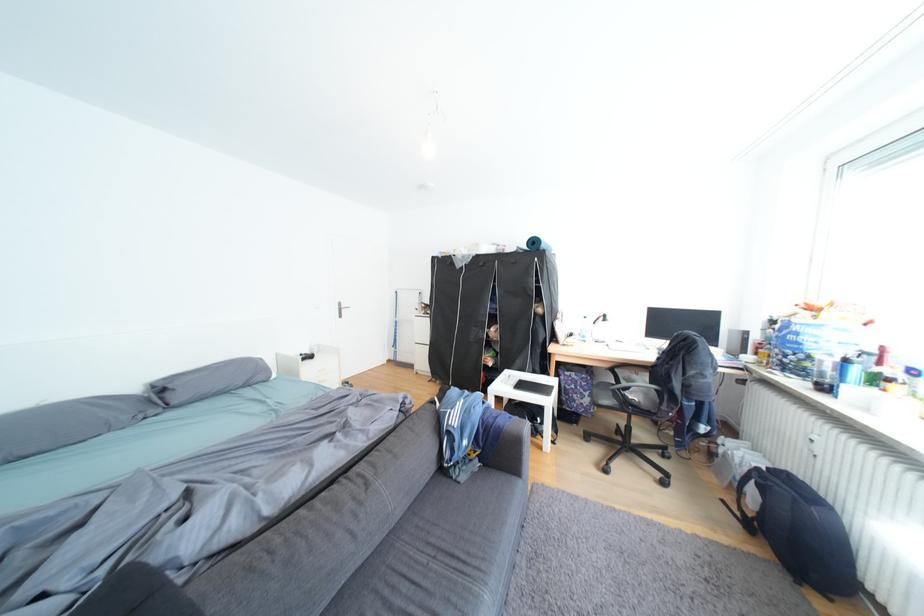
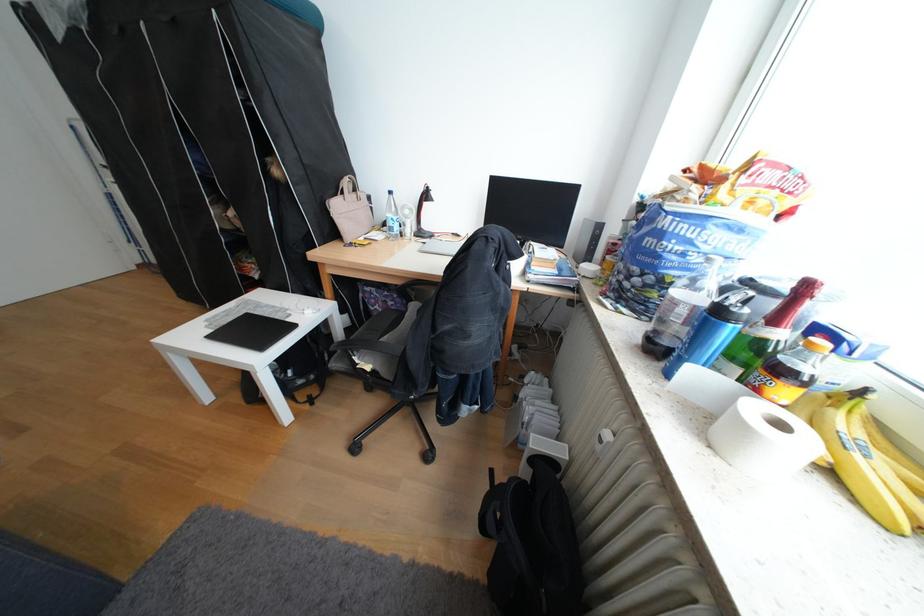
Locate, in the second image, the point that corresponds to (x=896, y=350) in the first image.

(819, 288)